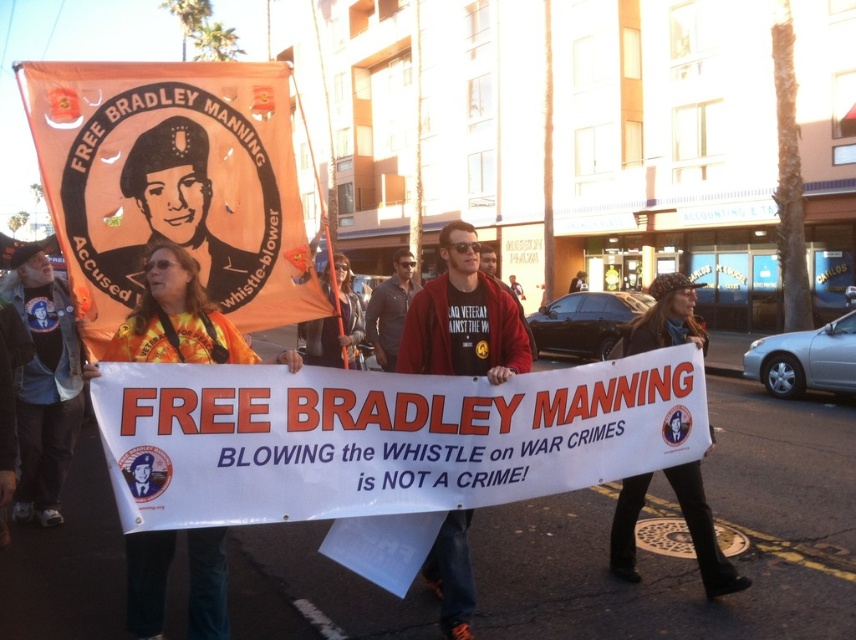
You are a photographer standing in front of the protest scene. You want to take a photo that includes both the point at location (19, 419) and the point at (387, 342). Which point should you focus on first to ensure both are in sharp focus?

You should focus on the point at (19, 419) first because it is closer to the camera than the point at (387, 342). This ensures the closer point is in focus, and the farther point will also be within the depth of field.

Looking at this image, what is the location of the point with coordinates (171, 182) in the protest scene?

The point with coordinates (171, 182) is located on the orange fabric banner at upper left.